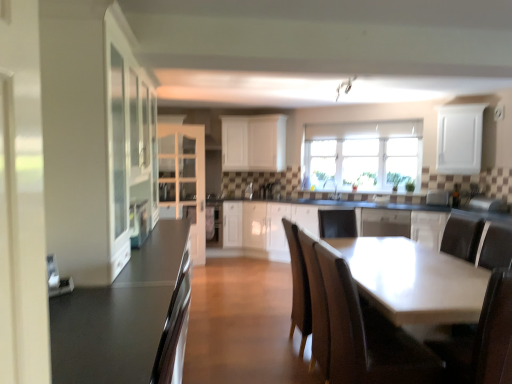
Question: Is white matte cabinet at upper center, positioned as the 5th cabinetry in front-to-back order, to the left of white glossy sink at center from the viewer's perspective?

Choices:
 (A) no
 (B) yes

Answer: (B)

Question: From the image's perspective, is white matte cabinet at upper center, which is the fourth cabinetry from left to right, on white glossy sink at center?

Choices:
 (A) yes
 (B) no

Answer: (A)

Question: Could you tell me if white matte cabinet at upper center, which is the fourth cabinetry from left to right, is turned towards white glossy sink at center?

Choices:
 (A) no
 (B) yes

Answer: (A)

Question: Can you confirm if white matte cabinet at upper center, marked as the third cabinetry in a right-to-left arrangement, is taller than white glossy sink at center?

Choices:
 (A) no
 (B) yes

Answer: (B)

Question: Is white matte cabinet at upper center, the 2th cabinetry when ordered from back to front, wider than white glossy sink at center?

Choices:
 (A) no
 (B) yes

Answer: (B)

Question: Would you consider white matte cabinet at upper center, positioned as the 5th cabinetry in front-to-back order, to be distant from white glossy sink at center?

Choices:
 (A) yes
 (B) no

Answer: (A)

Question: Considering the relative positions of white matte cabinet at upper right, which appears as the 5th cabinetry when viewed from the back, and white glossy dishwasher at center in the image provided, is white matte cabinet at upper right, which appears as the 5th cabinetry when viewed from the back, to the left of white glossy dishwasher at center from the viewer's perspective?

Choices:
 (A) yes
 (B) no

Answer: (B)

Question: Does white matte cabinet at upper right, which appears as the first cabinetry when viewed from the right, have a greater width compared to white glossy dishwasher at center?

Choices:
 (A) yes
 (B) no

Answer: (B)

Question: Does white matte cabinet at upper right, which appears as the first cabinetry when viewed from the right, have a larger size compared to white glossy dishwasher at center?

Choices:
 (A) no
 (B) yes

Answer: (A)

Question: Is the depth of white matte cabinet at upper right, positioned as the 6th cabinetry in left-to-right order, less than that of white glossy dishwasher at center?

Choices:
 (A) yes
 (B) no

Answer: (A)

Question: Considering the relative sizes of white matte cabinet at upper right, which is the 2th cabinetry from front to back, and white glossy dishwasher at center in the image provided, is white matte cabinet at upper right, which is the 2th cabinetry from front to back, taller than white glossy dishwasher at center?

Choices:
 (A) no
 (B) yes

Answer: (B)

Question: From a real-world perspective, is white matte cabinet at upper right, which appears as the 5th cabinetry when viewed from the back, on top of white glossy dishwasher at center?

Choices:
 (A) no
 (B) yes

Answer: (B)

Question: Is satin silver toaster at center, the third appliance in the front-to-back sequence, positioned behind smooth dark gray countertop at left?

Choices:
 (A) yes
 (B) no

Answer: (A)